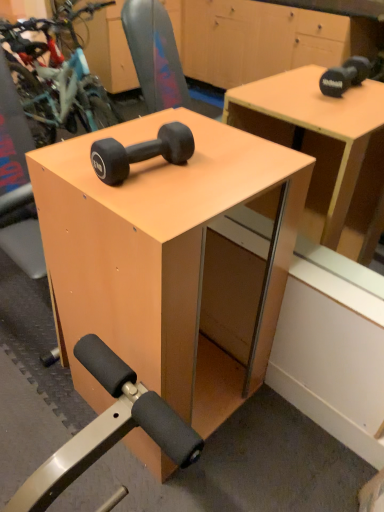
Question: Should I look upward or downward to see matte black dumbbell at center?

Choices:
 (A) up
 (B) down

Answer: (A)

Question: Is matte wood dumbbell at center completely or partially outside of matte black dumbbell at center?

Choices:
 (A) yes
 (B) no

Answer: (A)

Question: Are matte wood dumbbell at center and matte black dumbbell at center making contact?

Choices:
 (A) no
 (B) yes

Answer: (A)

Question: Is matte wood dumbbell at center positioned with its back to matte black dumbbell at center?

Choices:
 (A) yes
 (B) no

Answer: (B)

Question: Does matte wood dumbbell at center have a greater height compared to matte black dumbbell at center?

Choices:
 (A) no
 (B) yes

Answer: (B)

Question: Is matte wood dumbbell at center wider than matte black dumbbell at center?

Choices:
 (A) no
 (B) yes

Answer: (B)

Question: Does matte wood dumbbell at center turn towards matte black dumbbell at center?

Choices:
 (A) yes
 (B) no

Answer: (B)

Question: Is matte black dumbbell at center further to the viewer compared to matte wood dumbbell at center?

Choices:
 (A) no
 (B) yes

Answer: (B)

Question: Are matte black dumbbell at center and matte wood dumbbell at center making contact?

Choices:
 (A) yes
 (B) no

Answer: (B)

Question: Is matte black dumbbell at center smaller than matte wood dumbbell at center?

Choices:
 (A) no
 (B) yes

Answer: (B)

Question: From the image's perspective, does matte black dumbbell at center appear higher than matte wood dumbbell at center?

Choices:
 (A) yes
 (B) no

Answer: (A)

Question: Is matte black dumbbell at center positioned with its back to matte wood dumbbell at center?

Choices:
 (A) no
 (B) yes

Answer: (A)

Question: Can you confirm if matte black dumbbell at center is positioned to the right of matte wood dumbbell at center?

Choices:
 (A) yes
 (B) no

Answer: (B)

Question: Based on their positions, is matte wood dumbbell at center located to the left or right of matte black dumbbell at center?

Choices:
 (A) right
 (B) left

Answer: (A)